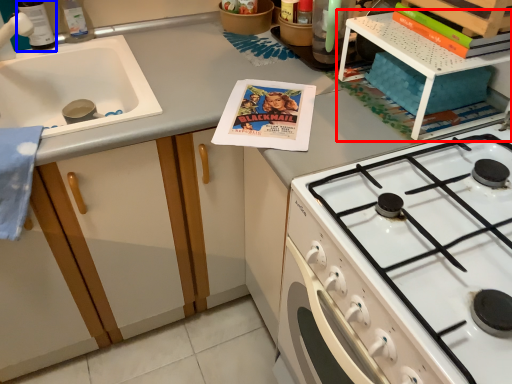
Question: Which of the following is the closest to the observer, shelf (highlighted by a red box) or bottle (highlighted by a blue box)?

Choices:
 (A) shelf
 (B) bottle

Answer: (A)